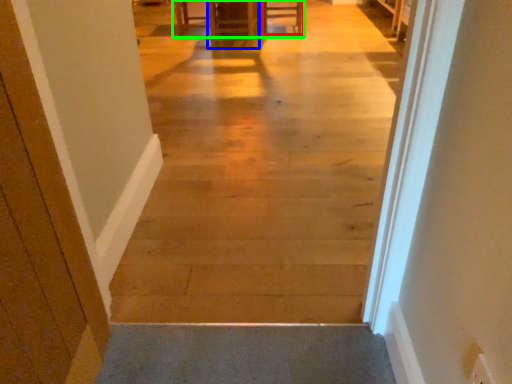
Question: Which object is the closest to the furniture (highlighted by a red box)? Choose among these: furniture (highlighted by a blue box) or table (highlighted by a green box).

Choices:
 (A) furniture
 (B) table

Answer: (A)